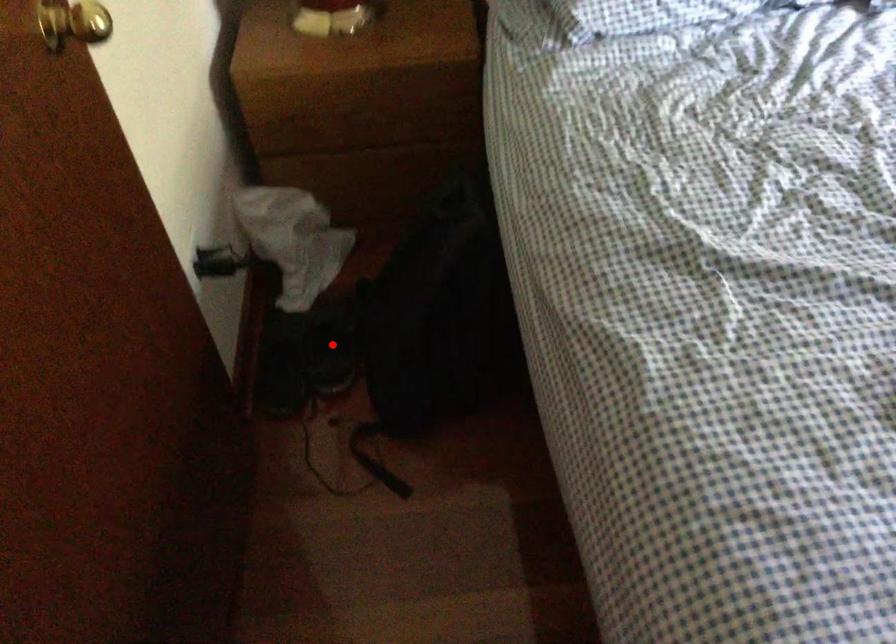
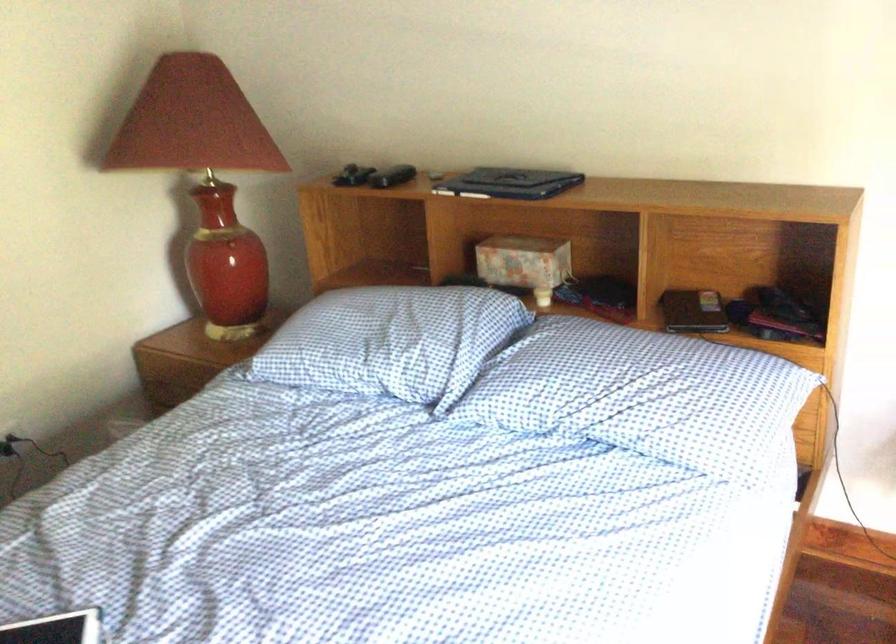
Question: I am providing you with two images of the same scene from different viewpoints. A red point is marked on the first image. Is the red point's position out of view in image 2?

Choices:
 (A) Yes
 (B) No

Answer: (A)